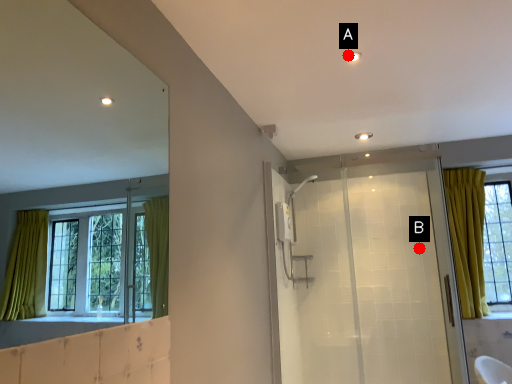
Question: Two points are circled on the image, labeled by A and B beside each circle. Which point is closer to the camera taking this photo?

Choices:
 (A) A is closer
 (B) B is closer

Answer: (A)